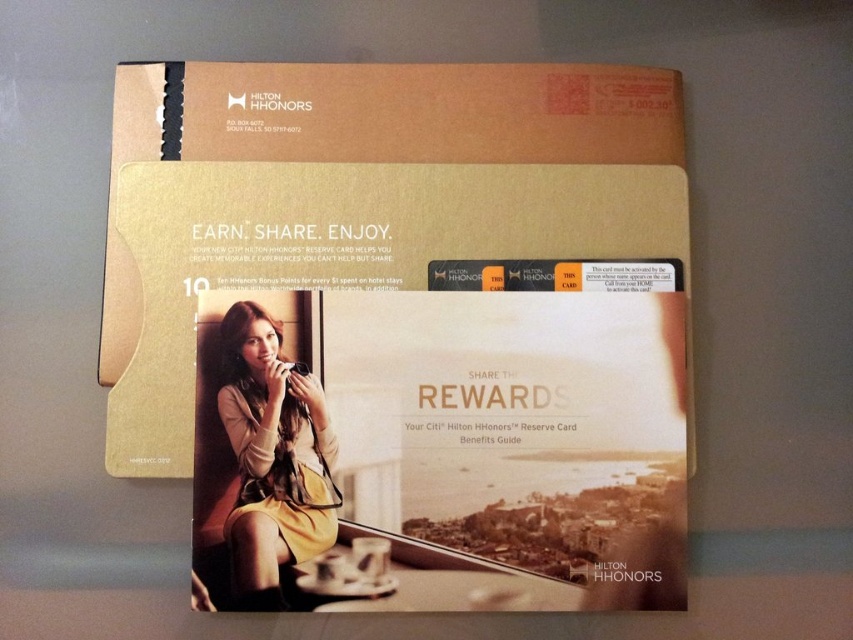
Question: Considering the relative positions of gold cardboard box at center and yellow fabric dress at center in the image provided, where is gold cardboard box at center located with respect to yellow fabric dress at center?

Choices:
 (A) right
 (B) left

Answer: (A)

Question: Can you confirm if gold cardboard box at center is bigger than yellow fabric dress at center?

Choices:
 (A) yes
 (B) no

Answer: (A)

Question: Is gold cardboard box at center closer to camera compared to yellow fabric dress at center?

Choices:
 (A) no
 (B) yes

Answer: (A)

Question: Among these points, which one is farthest from the camera?

Choices:
 (A) (293, 429)
 (B) (332, 237)

Answer: (B)